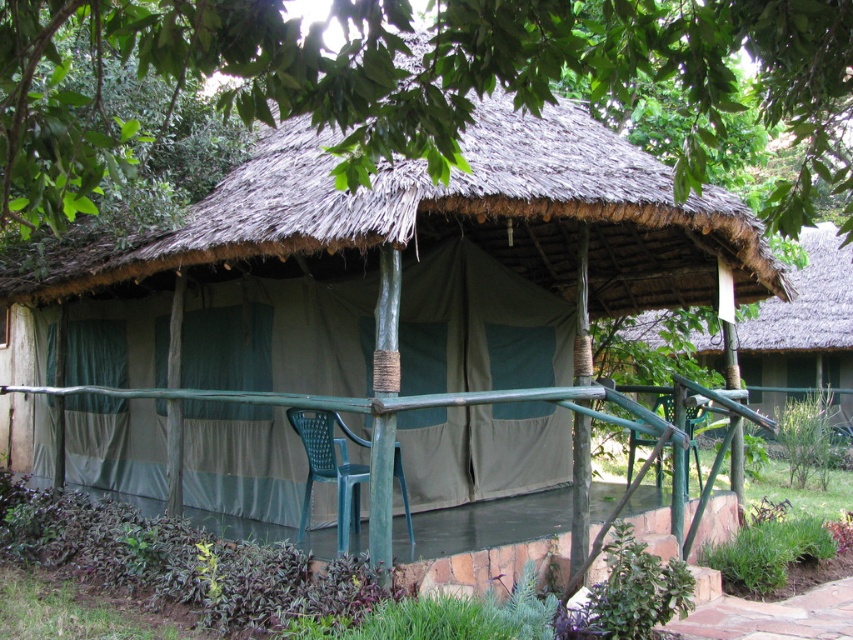
Question: In this image, where is green leafy tree at upper center located relative to green plastic chair at center?

Choices:
 (A) below
 (B) above

Answer: (B)

Question: Which object appears closest to the camera in this image?

Choices:
 (A) green fabric hut at center
 (B) green leafy tree at upper center

Answer: (B)

Question: Among these points, which one is farthest from the camera?

Choices:
 (A) (784, 380)
 (B) (397, 454)

Answer: (A)

Question: Which point is closer to the camera?

Choices:
 (A) (341, 497)
 (B) (646, 440)
 (C) (74, 205)
 (D) (759, 330)

Answer: (C)

Question: Can you confirm if blue plastic chair at center is smaller than green plastic chair at center?

Choices:
 (A) yes
 (B) no

Answer: (A)

Question: Is blue plastic chair at center to the left of green plastic chair at center from the viewer's perspective?

Choices:
 (A) no
 (B) yes

Answer: (B)